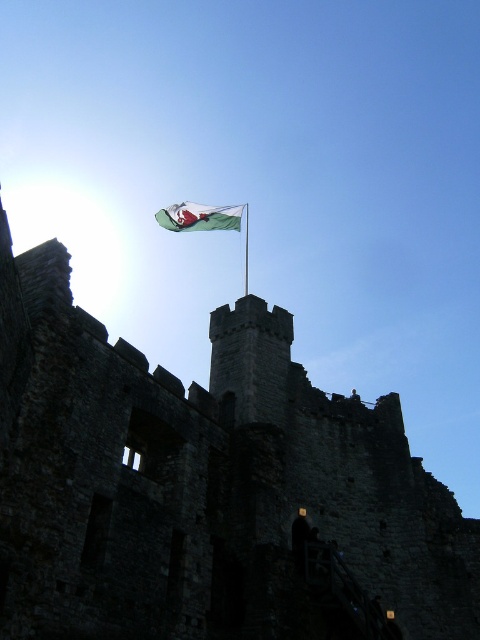
Question: Does dark stone castle at upper center come behind green fabric flag at upper center?

Choices:
 (A) no
 (B) yes

Answer: (A)

Question: In this image, where is green fabric flag at upper center located relative to green fabric flagpole at upper center?

Choices:
 (A) right
 (B) left

Answer: (B)

Question: Which of the following is the closest to the observer?

Choices:
 (A) green fabric flagpole at upper center
 (B) dark stone castle at upper center
 (C) green fabric flag at upper center

Answer: (B)

Question: Which object is closer to the camera taking this photo?

Choices:
 (A) dark stone castle at upper center
 (B) green fabric flagpole at upper center

Answer: (A)

Question: Can you confirm if dark stone castle at upper center is thinner than green fabric flag at upper center?

Choices:
 (A) no
 (B) yes

Answer: (A)

Question: Which point is closer to the camera?

Choices:
 (A) green fabric flagpole at upper center
 (B) dark stone castle at upper center
 (C) green fabric flag at upper center

Answer: (B)